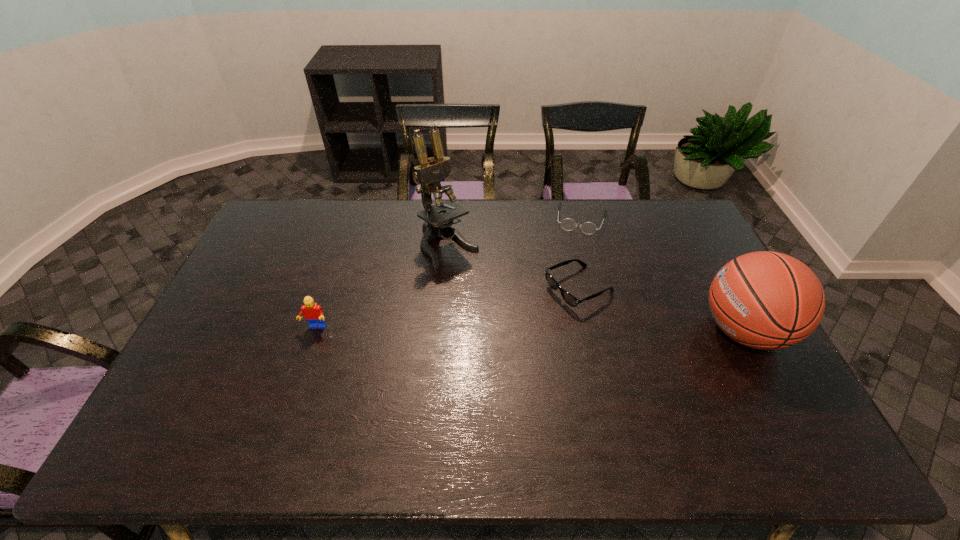
Image resolution: width=960 pixels, height=540 pixels. I want to click on free space on the desktop that is between the third shortest object and the rightmost object and is positioned at the eyepieces of the tallest object, so click(x=528, y=329).

Identify the location of vacant space on the desktop that is between the third shortest object and the basketball and is positioned on the lenses of the nearer spectacles. The image size is (960, 540). (498, 329).

Where is `vacant space on the desktop that is between the Lego and the fourth shortest object and is positioned through the lenses of the shortest object`? This screenshot has height=540, width=960. vacant space on the desktop that is between the Lego and the fourth shortest object and is positioned through the lenses of the shortest object is located at coordinates (557, 329).